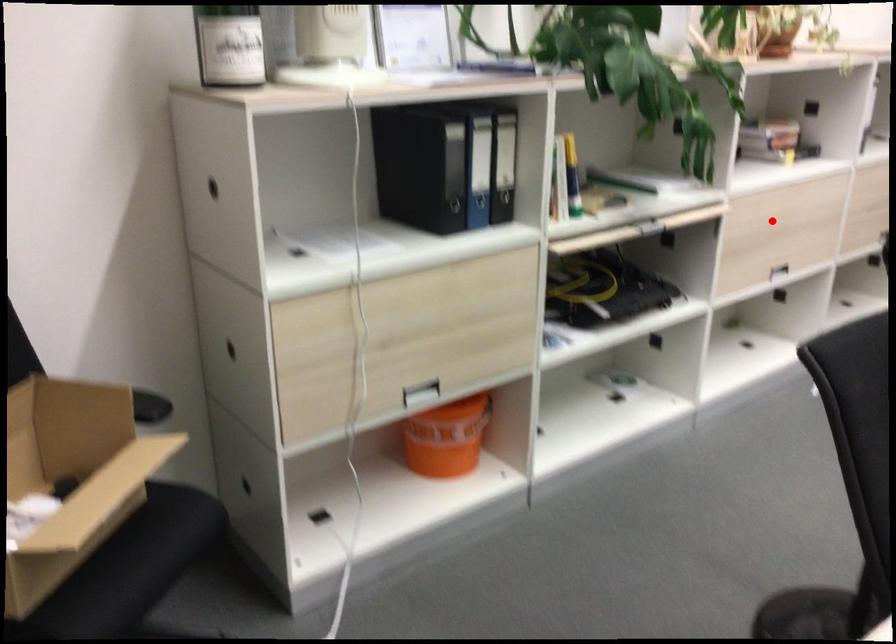
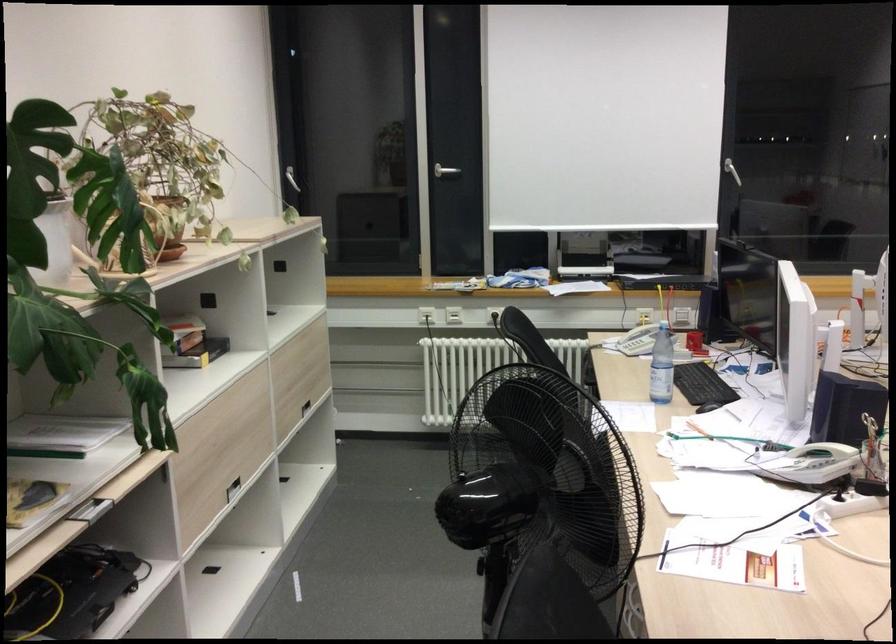
Where in the second image is the point corresponding to the highlighted location from the first image?

(225, 435)